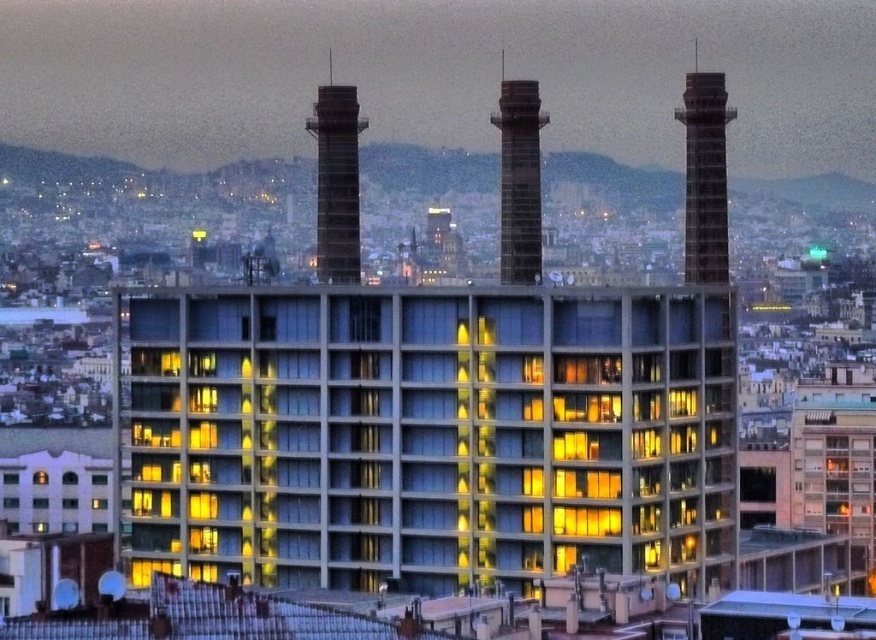
Question: Which of these objects is positioned closest to the smooth concrete chimney at center?

Choices:
 (A) rustic brick chimney at upper right
 (B) concrete chimney at center

Answer: (B)

Question: Based on their relative distances, which object is farther from the concrete building at center?

Choices:
 (A) smooth concrete chimney at center
 (B) rustic brick chimney at upper right

Answer: (A)

Question: Considering the relative positions of concrete chimney at center and smooth concrete chimney at center in the image provided, where is concrete chimney at center located with respect to smooth concrete chimney at center?

Choices:
 (A) below
 (B) above

Answer: (B)

Question: Which point is farther from the camera taking this photo?

Choices:
 (A) (471, 461)
 (B) (528, 204)
 (C) (323, 132)
 (D) (694, 182)

Answer: (B)

Question: Can you confirm if concrete building at center is positioned to the right of smooth concrete chimney at center?

Choices:
 (A) no
 (B) yes

Answer: (A)

Question: Can you confirm if rustic brick chimney at upper right is positioned to the right of smooth concrete chimney at center?

Choices:
 (A) no
 (B) yes

Answer: (B)